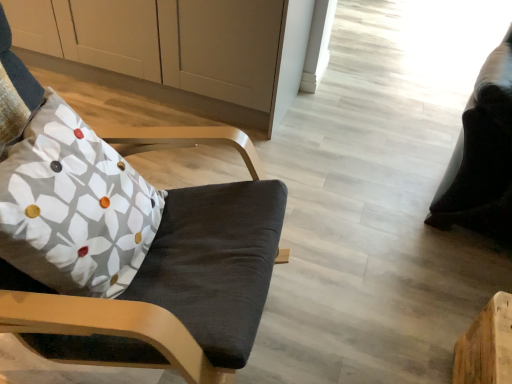
Question: Can you confirm if floral fabric pillow at left is shorter than black leather bean bag chair at right?

Choices:
 (A) yes
 (B) no

Answer: (A)

Question: Is floral fabric pillow at left positioned in front of black leather bean bag chair at right?

Choices:
 (A) no
 (B) yes

Answer: (B)

Question: Is floral fabric pillow at left with black leather bean bag chair at right?

Choices:
 (A) yes
 (B) no

Answer: (B)

Question: Is floral fabric pillow at left surrounding black leather bean bag chair at right?

Choices:
 (A) no
 (B) yes

Answer: (A)

Question: Is floral fabric pillow at left behind black leather bean bag chair at right?

Choices:
 (A) yes
 (B) no

Answer: (B)

Question: From the image's perspective, relative to black leather bean bag chair at right, is floral fabric pillow at left above or below?

Choices:
 (A) below
 (B) above

Answer: (A)

Question: Relative to black leather bean bag chair at right, is floral fabric pillow at left in front or behind?

Choices:
 (A) front
 (B) behind

Answer: (A)

Question: From a real-world perspective, is floral fabric pillow at left physically located above or below black leather bean bag chair at right?

Choices:
 (A) above
 (B) below

Answer: (A)

Question: Looking at the image, does floral fabric pillow at left seem bigger or smaller compared to black leather bean bag chair at right?

Choices:
 (A) small
 (B) big

Answer: (A)

Question: Considering the positions of black leather bean bag chair at right and white matte cabinet at upper left in the image, is black leather bean bag chair at right taller or shorter than white matte cabinet at upper left?

Choices:
 (A) tall
 (B) short

Answer: (A)

Question: Considering their positions, is black leather bean bag chair at right located in front of or behind white matte cabinet at upper left?

Choices:
 (A) behind
 (B) front

Answer: (B)

Question: From a real-world perspective, is black leather bean bag chair at right positioned above or below white matte cabinet at upper left?

Choices:
 (A) above
 (B) below

Answer: (A)

Question: From the image's perspective, is black leather bean bag chair at right positioned above or below white matte cabinet at upper left?

Choices:
 (A) below
 (B) above

Answer: (A)

Question: Which is correct: white matte cabinet at upper left is inside matte black chair at left, or outside of it?

Choices:
 (A) inside
 (B) outside

Answer: (B)

Question: In terms of width, does white matte cabinet at upper left look wider or thinner when compared to matte black chair at left?

Choices:
 (A) wide
 (B) thin

Answer: (B)